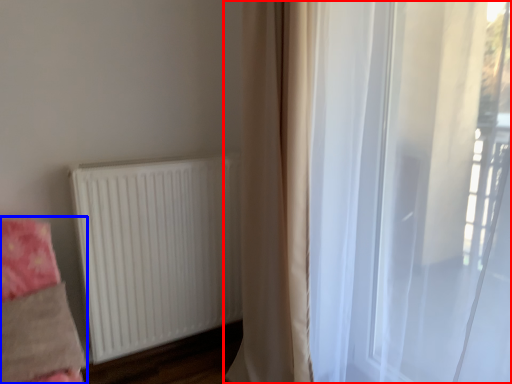
Question: Among these objects, which one is nearest to the camera, curtain (highlighted by a red box) or bedding (highlighted by a blue box)?

Choices:
 (A) curtain
 (B) bedding

Answer: (A)